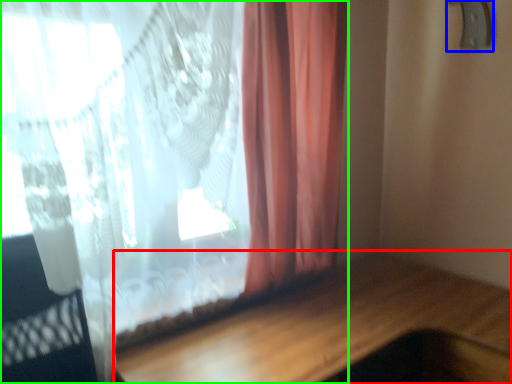
Question: Which object is positioned closest to table (highlighted by a red box)? Select from door handle (highlighted by a blue box) and curtain (highlighted by a green box).

Choices:
 (A) door handle
 (B) curtain

Answer: (B)